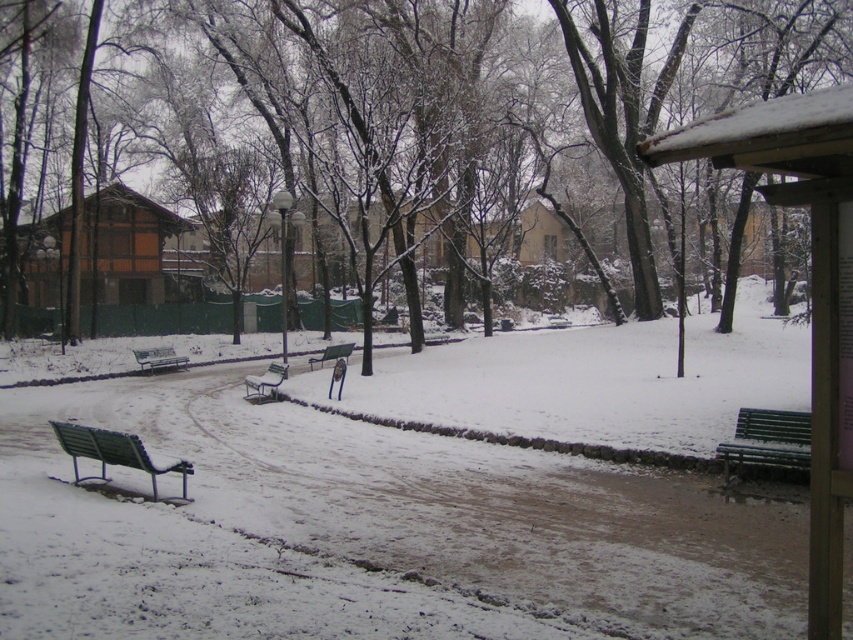
Does white matte snow at center have a larger size compared to metallic silver bench at center?

Indeed, white matte snow at center has a larger size compared to metallic silver bench at center.

Between white matte snow at center and metallic silver bench at center, which one is positioned higher?

white matte snow at center

Who is more distant from viewer, (x=585, y=467) or (x=166, y=362)?

The point (x=166, y=362) is behind.

Locate an element on the screen. white matte snow at center is located at coordinates (374, 525).

Consider the image. Who is more forward, (672, 413) or (660, 80)?

Point (672, 413)

Does point (532, 374) come in front of point (514, 97)?

Yes, it is in front of point (514, 97).

The height and width of the screenshot is (640, 853). I want to click on white matte snow at center, so click(x=374, y=525).

Can you confirm if wooden bench at right is wider than green wooden bench at center?

No.

Which is more to the left, wooden bench at right or green wooden bench at center?

green wooden bench at center is more to the left.

Between point (836, 118) and point (326, 349), which one is positioned behind?

The point (326, 349) is more distant.

Identify the location of wooden bench at right. This screenshot has width=853, height=640. (811, 285).